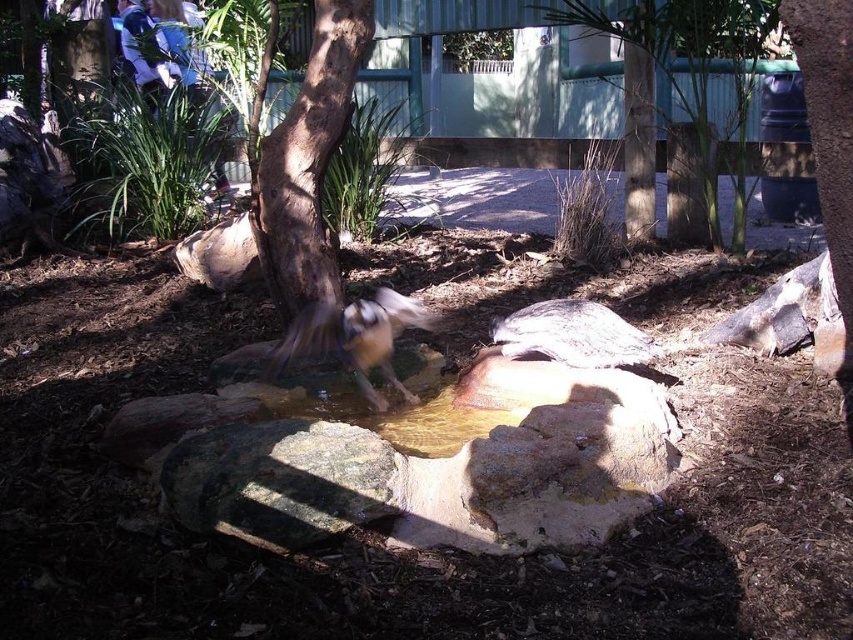
Question: Among these points, which one is nearest to the camera?

Choices:
 (A) (422, 445)
 (B) (622, 330)
 (C) (595, 20)
 (D) (323, 296)

Answer: (A)

Question: Considering the relative positions of gray textured turtle at center and white feathered bird at center in the image provided, where is gray textured turtle at center located with respect to white feathered bird at center?

Choices:
 (A) right
 (B) left

Answer: (A)

Question: Does brown rough bark tree at center appear on the right side of gray textured turtle at center?

Choices:
 (A) no
 (B) yes

Answer: (A)

Question: Among these objects, which one is nearest to the camera?

Choices:
 (A) brown textured tree at upper center
 (B) white feathered bird at center
 (C) brown rough bark tree at center
 (D) translucent wet rock at center

Answer: (D)

Question: Is gray textured turtle at center bigger than white feathered bird at center?

Choices:
 (A) yes
 (B) no

Answer: (A)

Question: Which of the following is the farthest from the observer?

Choices:
 (A) (753, 17)
 (B) (389, 424)
 (C) (303, 184)

Answer: (A)